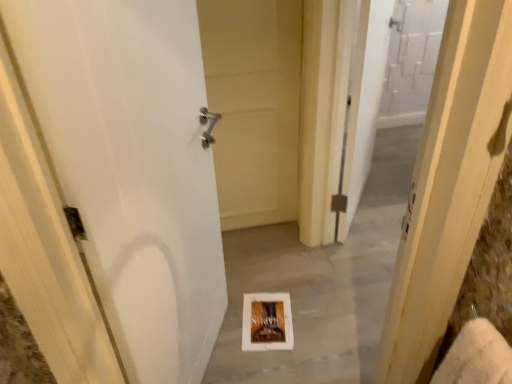
Where is `free space above white cardboard book at center (from a real-world perspective)`? free space above white cardboard book at center (from a real-world perspective) is located at coordinates (263, 312).